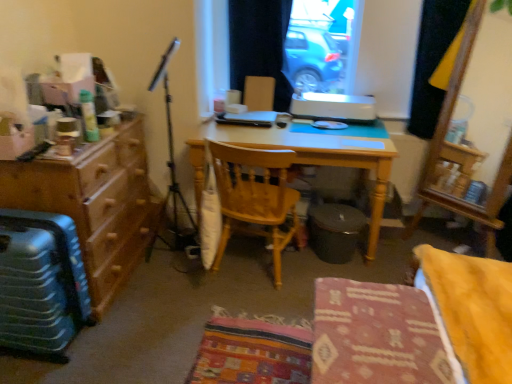
Question: Is metallic suitcase at lower left situated inside wooden chair at center, marked as the 2th chair in a front-to-back arrangement, or outside?

Choices:
 (A) inside
 (B) outside

Answer: (B)

Question: Is metallic suitcase at lower left taller or shorter than wooden chair at center, marked as the 2th chair in a front-to-back arrangement?

Choices:
 (A) tall
 (B) short

Answer: (B)

Question: Estimate the real-world distances between objects in this image. Which object is farther from the wooden chair at center?

Choices:
 (A) metallic suitcase at lower left
 (B) black fabric curtain at upper right, acting as the second curtain starting from the left
 (C) black fabric curtain at upper center, which is the first curtain in left-to-right order
 (D) brown wood dresser at left
 (E) light wood desk at center

Answer: (A)

Question: Which of these objects is positioned farthest from the wooden chair at center?

Choices:
 (A) patterned fabric chair at center, marked as the 2th chair in a back-to-front arrangement
 (B) black fabric curtain at upper right, which is counted as the 1th curtain, starting from the right
 (C) black fabric curtain at upper center, the second curtain positioned from the right
 (D) brown wood dresser at left
 (E) light wood desk at center

Answer: (A)